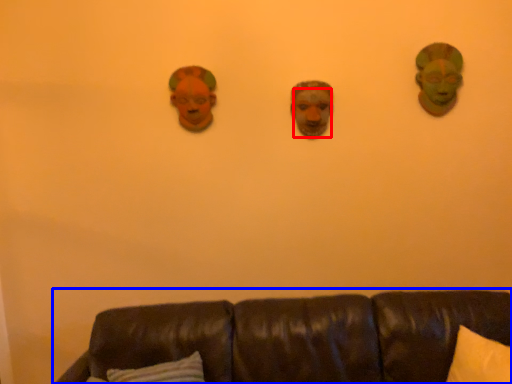
Question: Which of the following is the closest to the observer, human face (highlighted by a red box) or studio couch (highlighted by a blue box)?

Choices:
 (A) human face
 (B) studio couch

Answer: (B)